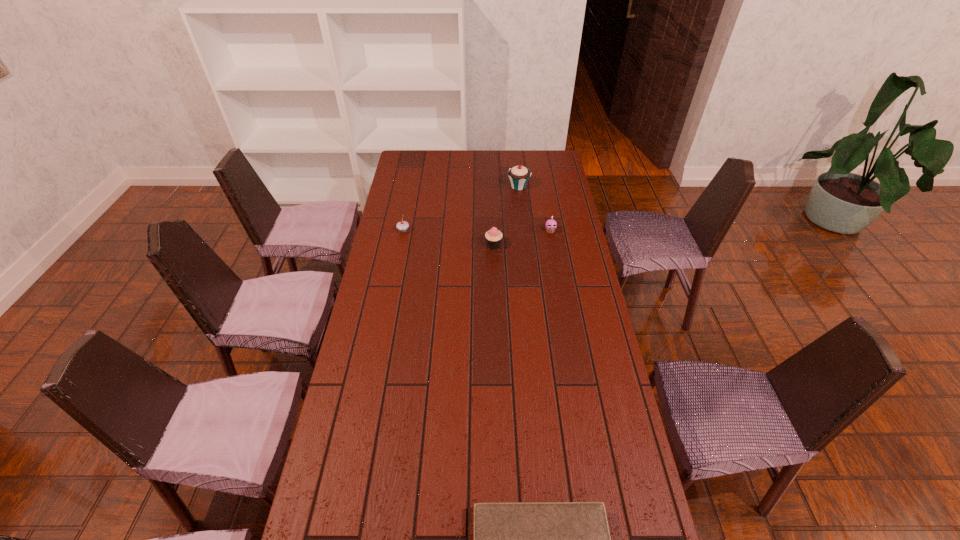
The image size is (960, 540). I want to click on object at the left edge, so click(403, 225).

Find the location of `object located at the right edge`. object located at the right edge is located at coordinates (551, 224).

Where is `blank area at the left edge`? The width and height of the screenshot is (960, 540). blank area at the left edge is located at coordinates (393, 362).

Where is `vacant space at the right edge of the desktop`? vacant space at the right edge of the desktop is located at coordinates (639, 523).

Find the location of a particular element. The width and height of the screenshot is (960, 540). vacant region at the far left corner of the desktop is located at coordinates 420,168.

Locate an element on the screen. The image size is (960, 540). free area in between the third cupcake from left to right and the rightmost cupcake is located at coordinates click(x=535, y=209).

The width and height of the screenshot is (960, 540). What are the coordinates of `free space between the fourth farthest object and the leftmost cupcake` in the screenshot? It's located at (448, 238).

Find the location of a particular element. empty space that is in between the farthest object and the third cupcake from right to left is located at coordinates (506, 216).

Where is `vacant space that's between the leftmost object and the tallest object`? This screenshot has width=960, height=540. vacant space that's between the leftmost object and the tallest object is located at coordinates (461, 209).

At what (x,y) coordinates should I click in order to perform the action: click on free space between the fourth farthest object and the farthest cupcake. Please return your answer as a coordinate pair (x, y). Looking at the image, I should click on (506, 216).